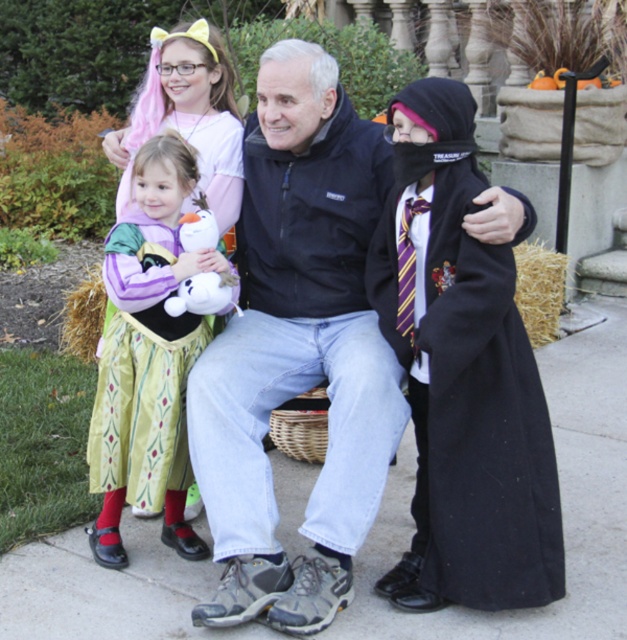
You are a photographer trying to capture a photo of the black woolen robe at right and the green satin dress at left. Based on their heights, which one should you focus on first to ensure both are in frame?

The black woolen robe at right is taller than the green satin dress at left, so you should focus on the black woolen robe at right first to ensure both are in frame.

Based on the scene description, where is the matte black coat at center located in terms of coordinates?

The matte black coat at center is located at point 0.544 on the x axis and 0.475 on the y axis.